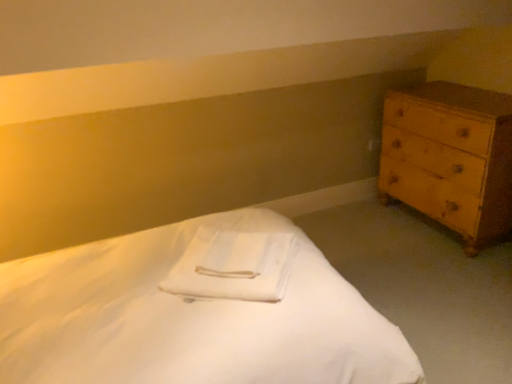
Question: Does white smooth bed at center have a smaller size compared to light brown wooden chest of drawers at right?

Choices:
 (A) yes
 (B) no

Answer: (B)

Question: From the image's perspective, is white smooth bed at center on top of light brown wooden chest of drawers at right?

Choices:
 (A) no
 (B) yes

Answer: (A)

Question: Is white smooth bed at center at the right side of light brown wooden chest of drawers at right?

Choices:
 (A) yes
 (B) no

Answer: (B)

Question: Does white smooth bed at center have a lesser width compared to light brown wooden chest of drawers at right?

Choices:
 (A) yes
 (B) no

Answer: (B)

Question: Can you confirm if white smooth bed at center is wider than light brown wooden chest of drawers at right?

Choices:
 (A) yes
 (B) no

Answer: (A)

Question: Is white smooth bed at center looking in the opposite direction of light brown wooden chest of drawers at right?

Choices:
 (A) no
 (B) yes

Answer: (A)

Question: Is light brown wooden chest of drawers at right shorter than white smooth bed at center?

Choices:
 (A) yes
 (B) no

Answer: (B)

Question: From a real-world perspective, is light brown wooden chest of drawers at right physically above white smooth bed at center?

Choices:
 (A) yes
 (B) no

Answer: (A)

Question: Considering the relative sizes of light brown wooden chest of drawers at right and white smooth bed at center in the image provided, is light brown wooden chest of drawers at right bigger than white smooth bed at center?

Choices:
 (A) no
 (B) yes

Answer: (A)

Question: Considering the relative sizes of light brown wooden chest of drawers at right and white smooth bed at center in the image provided, is light brown wooden chest of drawers at right wider than white smooth bed at center?

Choices:
 (A) no
 (B) yes

Answer: (A)

Question: Is white smooth bed at center at the back of light brown wooden chest of drawers at right?

Choices:
 (A) yes
 (B) no

Answer: (B)

Question: From the image's perspective, does light brown wooden chest of drawers at right appear lower than white smooth bed at center?

Choices:
 (A) yes
 (B) no

Answer: (B)

Question: Does light brown wooden chest of drawers at right appear on the right side of white soft towel at center?

Choices:
 (A) no
 (B) yes

Answer: (B)